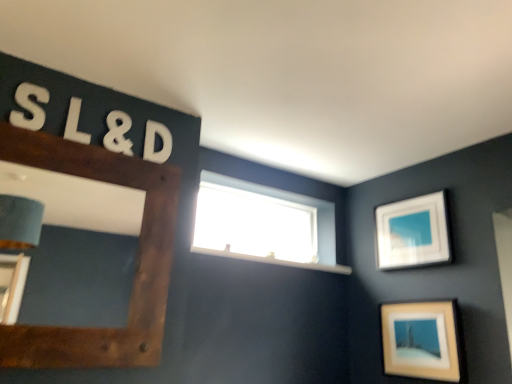
Question: Considering their positions, is matte white picture frame at lower right, placed as the 2th picture frame when sorted from left to right, located in front of or behind transparent glass window at upper center?

Choices:
 (A) behind
 (B) front

Answer: (B)

Question: In terms of width, does matte white picture frame at lower right, the second picture frame from the front, look wider or thinner when compared to transparent glass window at upper center?

Choices:
 (A) thin
 (B) wide

Answer: (A)

Question: Estimate the real-world distances between objects in this image. Which object is closer to the transparent glass window at upper center?

Choices:
 (A) matte white picture frame at lower right, placed as the 2th picture frame when sorted from left to right
 (B) white foam letter s at upper left, positioned as the 2th number in back-to-front order
 (C) white matte letter d at upper center, which is the 2th letter from front to back
 (D) white foam ampersand at upper left, which is the 2th number from front to back
 (E) white foam letter l at upper left, which is counted as the 1th letter, starting from the front

Answer: (A)

Question: Estimate the real-world distances between objects in this image. Which object is farther from the white matte picture frame at upper right, the third picture frame positioned from the front?

Choices:
 (A) white foam ampersand at upper left, the 2th number from the left
 (B) brown wooden picture frame at left, arranged as the 3th picture frame when viewed from the back
 (C) white matte letter d at upper center, which is the first letter in back-to-front order
 (D) white foam letter l at upper left, the 2th letter positioned from the back
 (E) matte white picture frame at lower right, marked as the 2th picture frame in a back-to-front arrangement

Answer: (D)